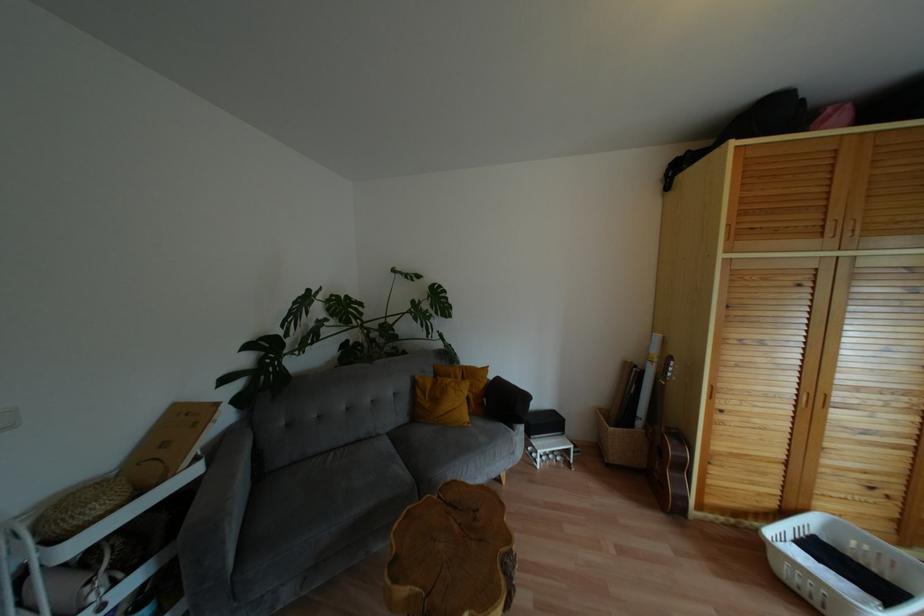
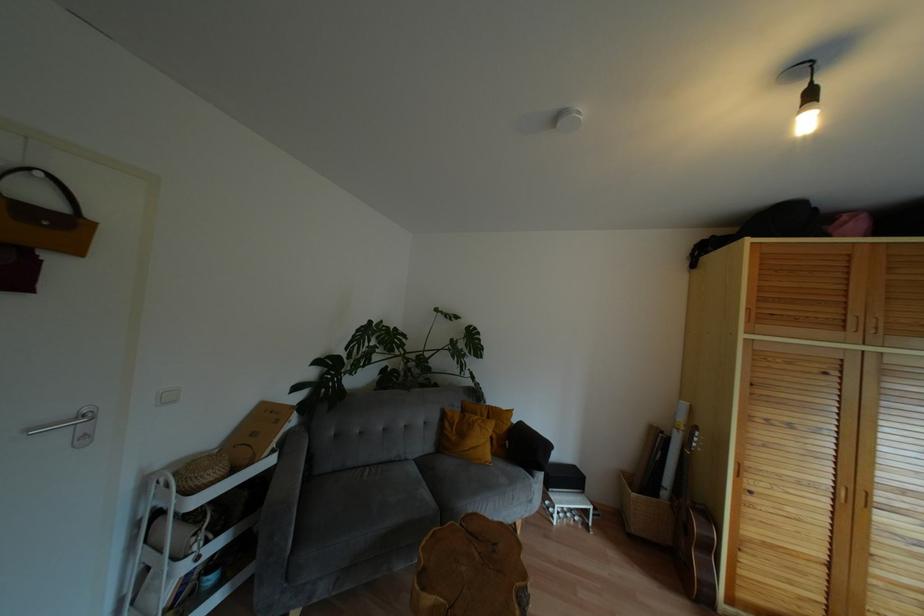
What movement of the cameraman would produce the second image?

The cameraman moved toward left, backward.